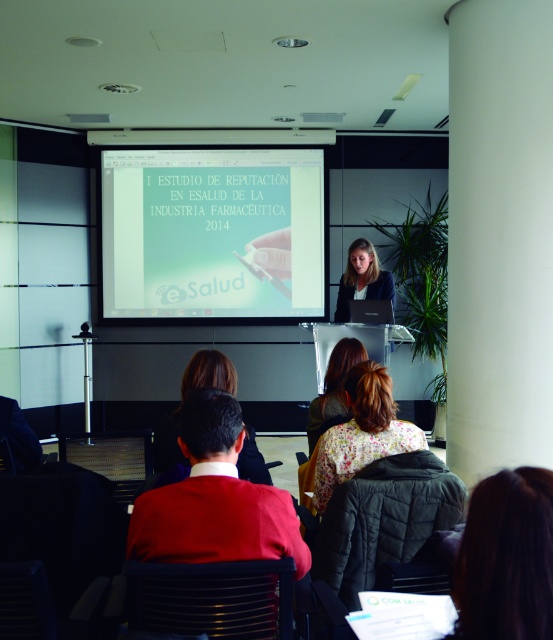
Question: Which point is closer to the camera?

Choices:
 (A) white glossy projector screen at center
 (B) dark brown hair at lower center
 (C) floral fabric dress at center

Answer: (B)

Question: Where is floral fabric jacket at center located in relation to matte black laptop at center in the image?

Choices:
 (A) right
 (B) left

Answer: (B)

Question: Estimate the real-world distances between objects in this image. Which object is farther from the red wool sweater at center?

Choices:
 (A) white glossy projector screen at center
 (B) matte black laptop at center

Answer: (A)

Question: Can you confirm if floral fabric dress at center is wider than matte black laptop at center?

Choices:
 (A) no
 (B) yes

Answer: (A)

Question: Which point is farther to the camera?

Choices:
 (A) (153, 157)
 (B) (268, 554)

Answer: (A)

Question: Can you confirm if white glossy projector screen at center is smaller than dark brown hair at lower center?

Choices:
 (A) yes
 (B) no

Answer: (B)